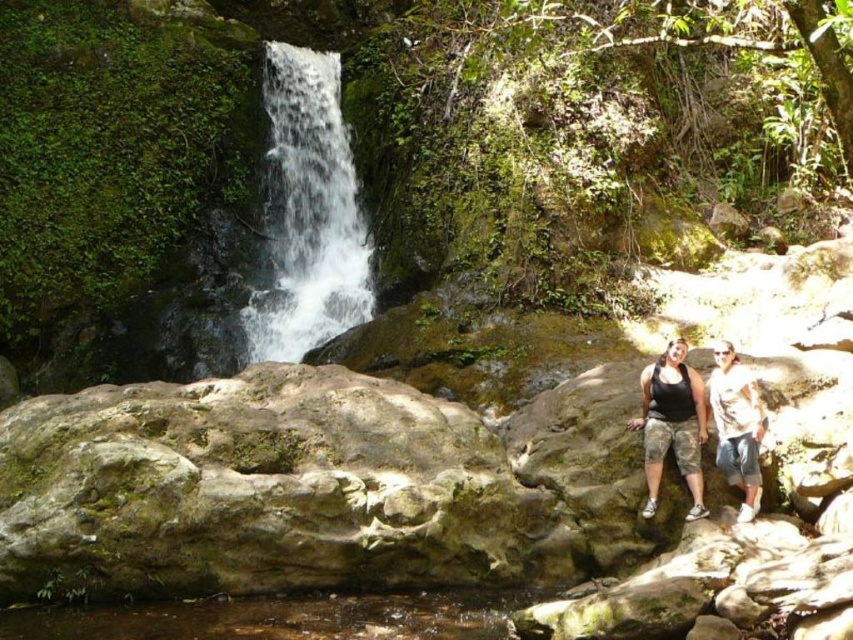
Question: Which of these objects is positioned farthest from the camouflage pants at lower right?

Choices:
 (A) brown sedimentary rock at lower center
 (B) white frothy water at center
 (C) matte black tank top at lower right

Answer: (B)

Question: Is white frothy water at center closer to the viewer compared to brown sedimentary rock at lower center?

Choices:
 (A) yes
 (B) no

Answer: (B)

Question: Considering the real-world distances, which object is farthest from the matte black tank top at lower right?

Choices:
 (A) camouflage pants at lower right
 (B) white frothy water at center
 (C) brown sedimentary rock at lower center

Answer: (B)

Question: Which point appears closest to the camera in this image?

Choices:
 (A) (757, 388)
 (B) (749, 452)

Answer: (B)

Question: Is white frothy water at center above camouflage pants at lower right?

Choices:
 (A) yes
 (B) no

Answer: (A)

Question: In this image, where is brown sedimentary rock at lower center located relative to matte black tank top at lower right?

Choices:
 (A) above
 (B) below

Answer: (B)